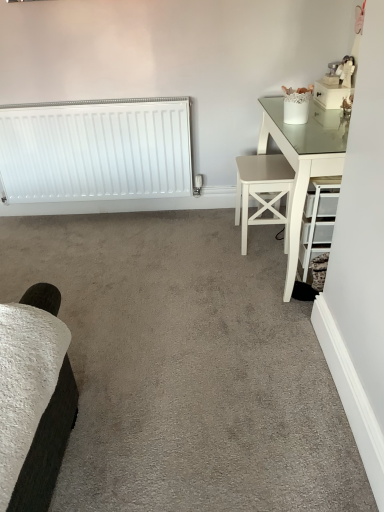
Locate an element on the screen. The image size is (384, 512). free space above white wood stool at right (from a real-world perspective) is located at coordinates (263, 162).